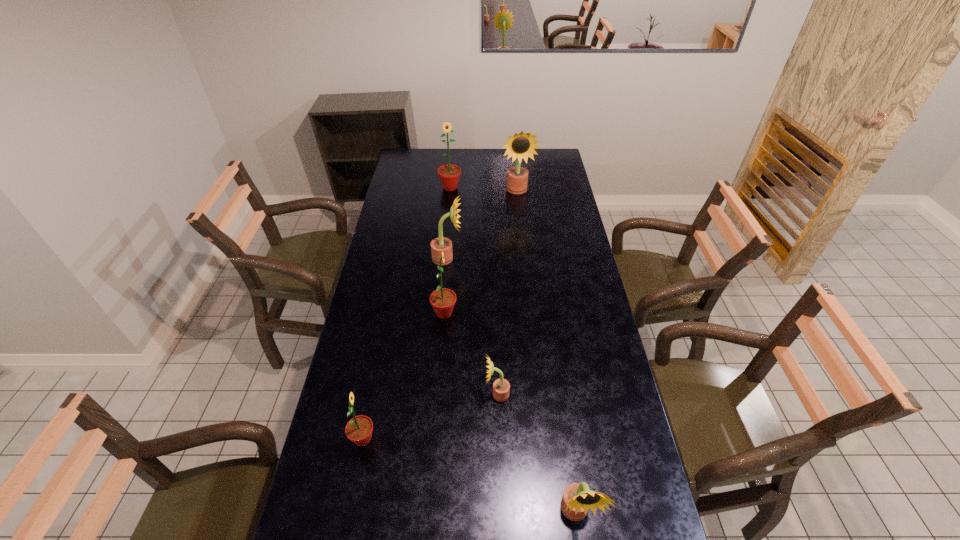
At what (x,y) coordinates should I click in order to perform the action: click on vacant space that satisfies the following two spatial constraints: 1. on the face of the biggest green sunflower; 2. on the face of the leftmost green sunflower. Please return your answer as a coordinate pair (x, y). Looking at the image, I should click on (428, 439).

You are a GUI agent. You are given a task and a screenshot of the screen. Output one action in this format:
    pyautogui.click(x=<x>, y=<y>)
    Task: Click on the free location that satisfies the following two spatial constraints: 1. on the face of the biggest yellow sunflower; 2. on the face of the third smallest yellow sunflower
    The height and width of the screenshot is (540, 960).
    Given the screenshot: What is the action you would take?
    524,258